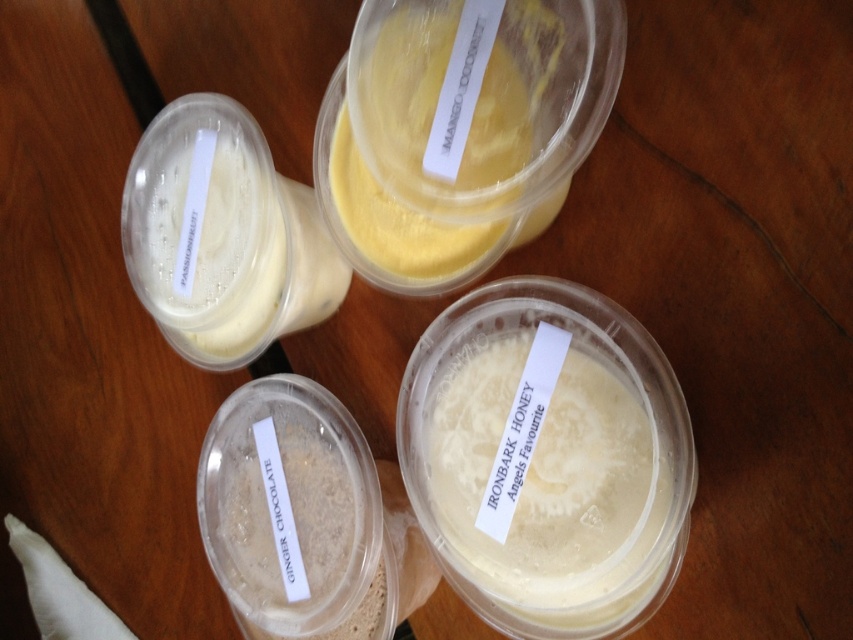
Please provide the coordinates of the white creamy milkshake at center in the image. Coordinates should be given as a point with x and y values between 0 and 1, where the origin is the top left corner of the image.

The white creamy milkshake at center is located at coordinates point (548, 483).

You are organizing a food tasting event and need to arrange the yellow matte jar at upper left and the yellow matte jar at upper center for display. According to the image, which jar should be placed in front to ensure both are visible?

The yellow matte jar at upper left should be placed in front to ensure both are visible because the yellow matte jar at upper center is behind it in the original image.

In the scene shown: You are organizing a dessert bar and need to arrange the white creamy milkshake at center and the yellow matte jar at upper center in a specific order. According to their current positions, which one is on the right side?

The white creamy milkshake at center is positioned on the right side of the yellow matte jar at upper center, so it is the one on the right.